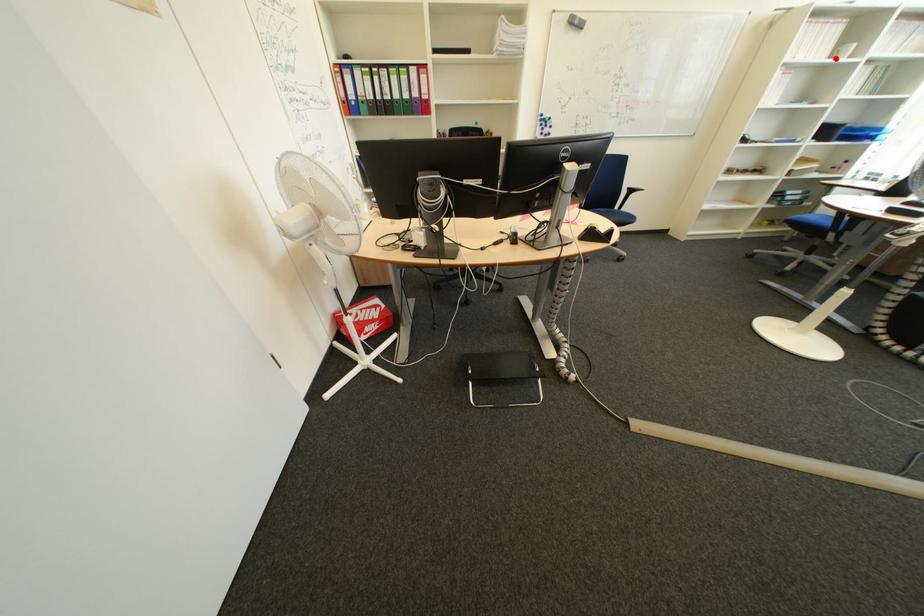
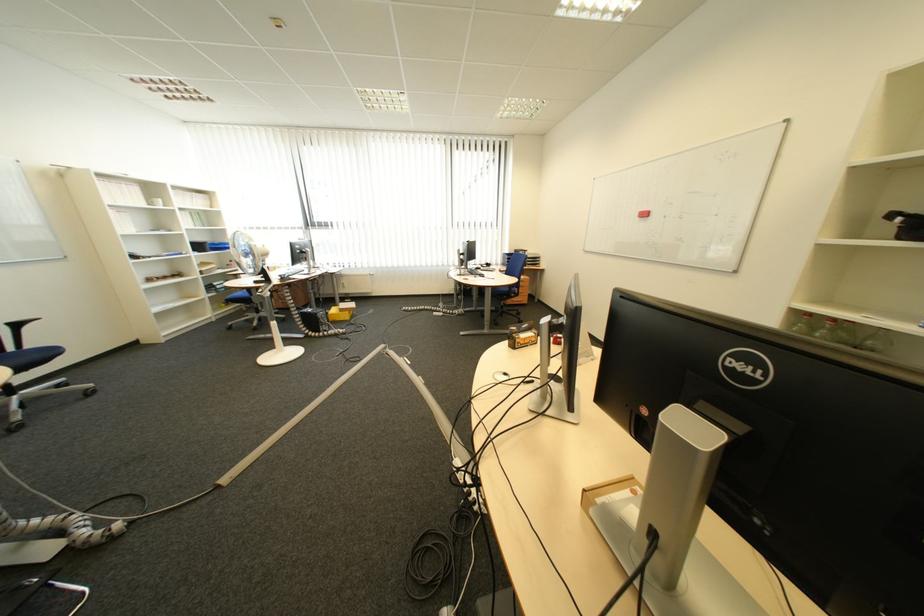
Where in the second image is the point corresponding to the highlighted location from the first image?

(155, 206)